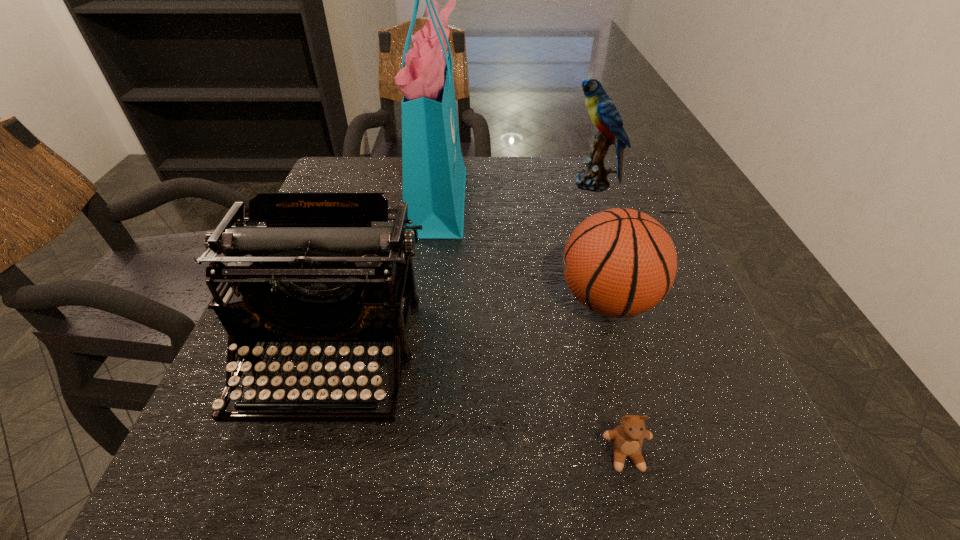
Where is `free space located 0.070m on the typing side of the typewriter`? This screenshot has height=540, width=960. free space located 0.070m on the typing side of the typewriter is located at coordinates (296, 480).

The image size is (960, 540). In order to click on free point located on the side where the inflation valve is located in this screenshot , I will do `click(348, 301)`.

Identify the location of free space located on the side where the inflation valve is located. (369, 301).

What are the coordinates of `vacant space located 0.190m on the side where the inflation valve is located` in the screenshot? It's located at (457, 301).

You are a GUI agent. You are given a task and a screenshot of the screen. Output one action in this format:
    pyautogui.click(x=<x>, y=<y>)
    Task: Click on the shopping bag that is at the far edge
    
    Given the screenshot: What is the action you would take?
    pyautogui.click(x=433, y=172)

The height and width of the screenshot is (540, 960). Identify the location of parrot that is at the far edge. (604, 115).

The width and height of the screenshot is (960, 540). Identify the location of object that is at the near edge. (626, 439).

Where is `object that is at the left edge`? Image resolution: width=960 pixels, height=540 pixels. object that is at the left edge is located at coordinates tap(318, 271).

You are a GUI agent. You are given a task and a screenshot of the screen. Output one action in this format:
    pyautogui.click(x=<x>, y=<y>)
    Task: Click on the parrot that is positioned at the right edge
    Image resolution: width=960 pixels, height=540 pixels.
    Given the screenshot: What is the action you would take?
    pyautogui.click(x=604, y=115)

This screenshot has width=960, height=540. Find the location of `basketball at the right edge`. basketball at the right edge is located at coordinates (620, 262).